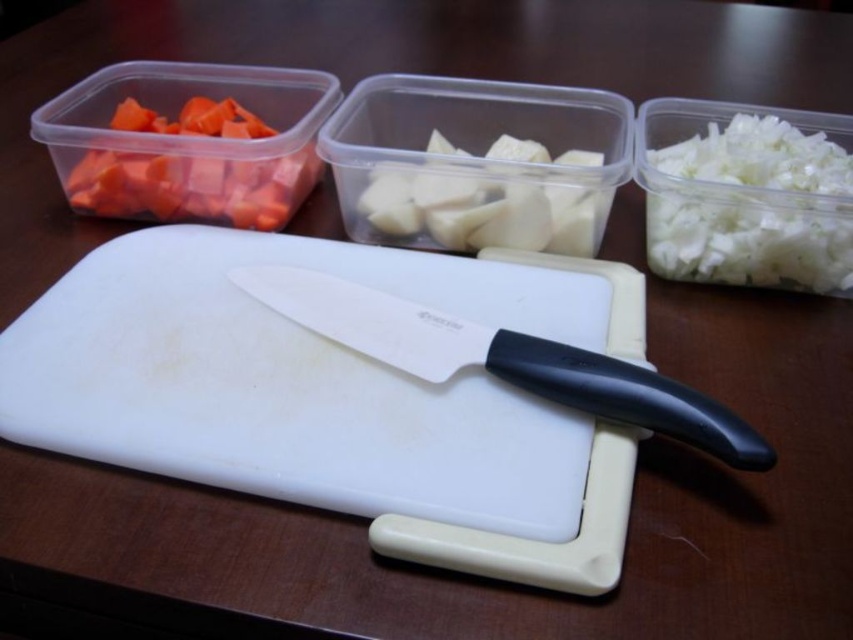
You are preparing to store the chopped vegetables in the containers. You need to move the white plastic cutting board at center to the sink, which is behind the white matte potato at center. Can you move the cutting board without moving the potato?

The white plastic cutting board at center and white matte potato at center are 16.66 centimeters apart from each other. Since there is a gap between them, you can move the cutting board without disturbing the potato.

You are preparing a salad and need to know which item is wider. You have a white plastic cutting board at center and a white shredded onion at right. Which one is wider?

The white plastic cutting board at center is wider than the white shredded onion at right.

You are organizing vegetables in the kitchen. You have an orange matte carrot at upper left and a white matte potato at center. Which vegetable is positioned higher in the image?

The orange matte carrot at upper left is positioned higher than the white matte potato at center.